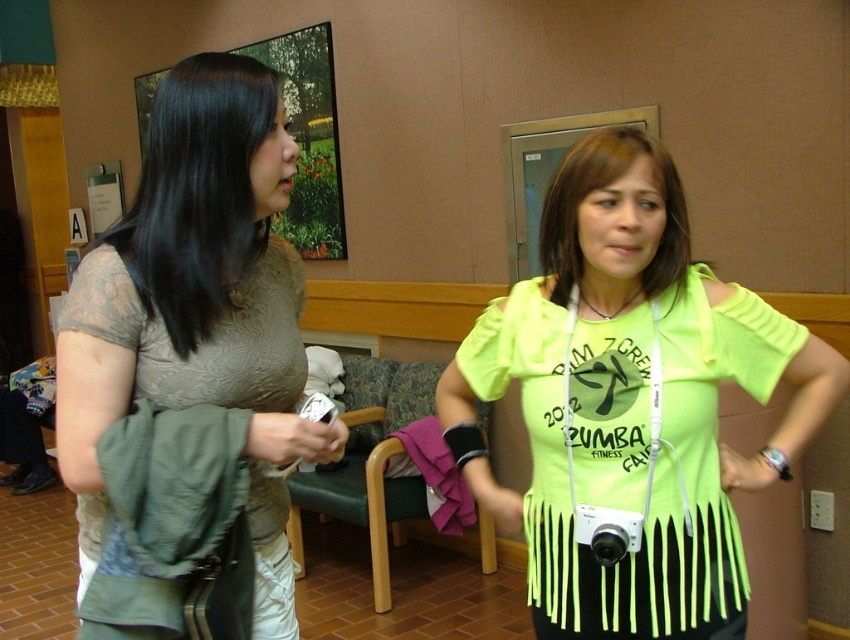
You are a photographer trying to capture a candid shot of both the neon yellow fabric shirt at center and the matte beige blouse at upper left. Which shirt should you focus on first to ensure both are in frame?

The neon yellow fabric shirt at center is positioned on the right side of matte beige blouse at upper left, so you should focus on the matte beige blouse at upper left first to ensure both are in frame.

You are a fashion designer observing the image. You need to decide which garment is shorter in height between the neon yellow fabric shirt at center and the matte beige blouse at upper left. Which one is it?

The neon yellow fabric shirt at center is not as tall as the matte beige blouse at upper left, so the neon yellow fabric shirt at center is shorter in height.